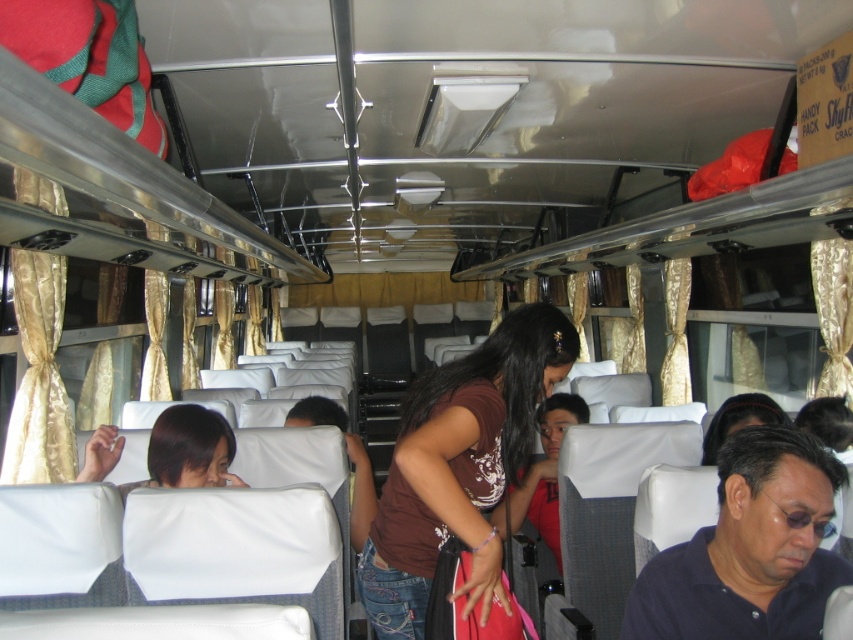
You are a passenger on the bus and want to reach the two points marked in the image. Which point, point (517, 433) or point (511, 490), is closer to you?

Point (517, 433) is closer to the viewer than point (511, 490).

You are a passenger sitting in the aisle seat of the bus. You notice two shirts in the scene. The dark blue shirt at lower right and the brown fabric shirt at center. Which shirt is closer to the window?

The dark blue shirt at lower right is closer to the window because it is positioned to the right of the brown fabric shirt at center, and since the aisle is central, the right side would be near the window.

You are a passenger on a bus and want to know if you can easily pass between the dark blue shirt at lower right and the brown fabric shirt at center without disturbing them. The average width of a person is 18 inches. Can you fit through the space between them?

The dark blue shirt at lower right and brown fabric shirt at center are 35.17 inches apart, which is wider than the average person width of 18 inches. Yes, you can easily pass between them without disturbing the passengers.